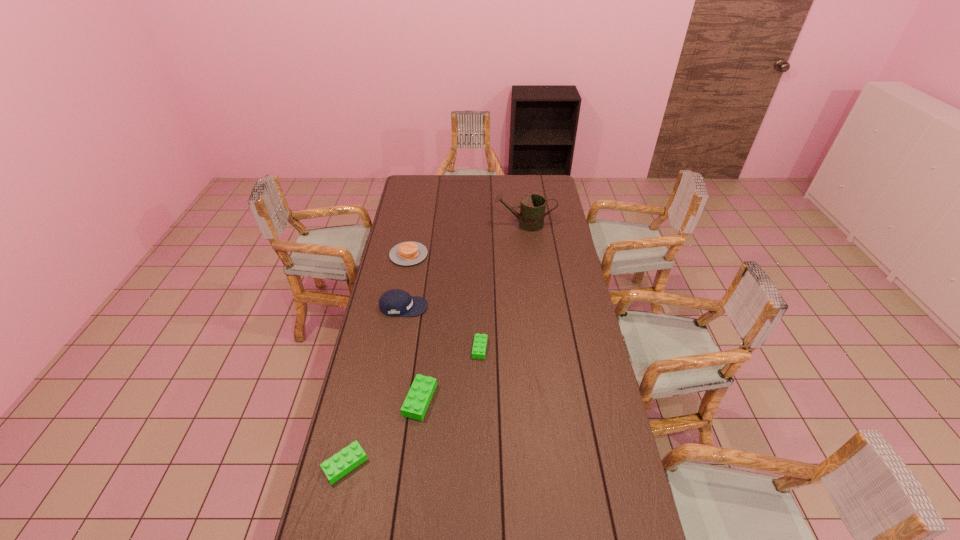
With all Legos evenly spaced, where should an extra Lego be placed on the right to continue the pattern? Please point out a vacant space. Please provide its 2D coordinates. Your answer should be formatted as a tuple, i.e. [(x, y)], where the tuple contains the x and y coordinates of a point satisfying the conditions above.

[(529, 306)]